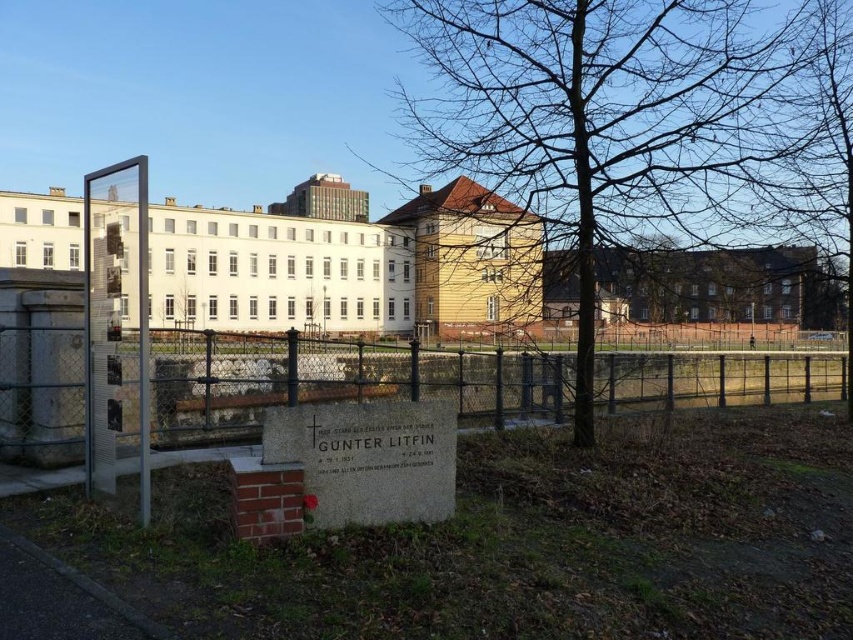
Question: Does bare branches at center have a lesser width compared to metallic chain-link fence at center?

Choices:
 (A) yes
 (B) no

Answer: (A)

Question: Among these points, which one is farthest from the camera?

Choices:
 (A) (491, 106)
 (B) (221, 374)

Answer: (B)

Question: Does bare branches at center appear on the left side of metallic chain-link fence at center?

Choices:
 (A) yes
 (B) no

Answer: (A)

Question: Does bare branches at center have a lesser width compared to metallic chain-link fence at center?

Choices:
 (A) yes
 (B) no

Answer: (A)

Question: Which point is closer to the camera?

Choices:
 (A) metallic chain-link fence at center
 (B) bare branches at center

Answer: (A)

Question: Which of the following is the closest to the observer?

Choices:
 (A) (78, 368)
 (B) (640, 147)

Answer: (A)